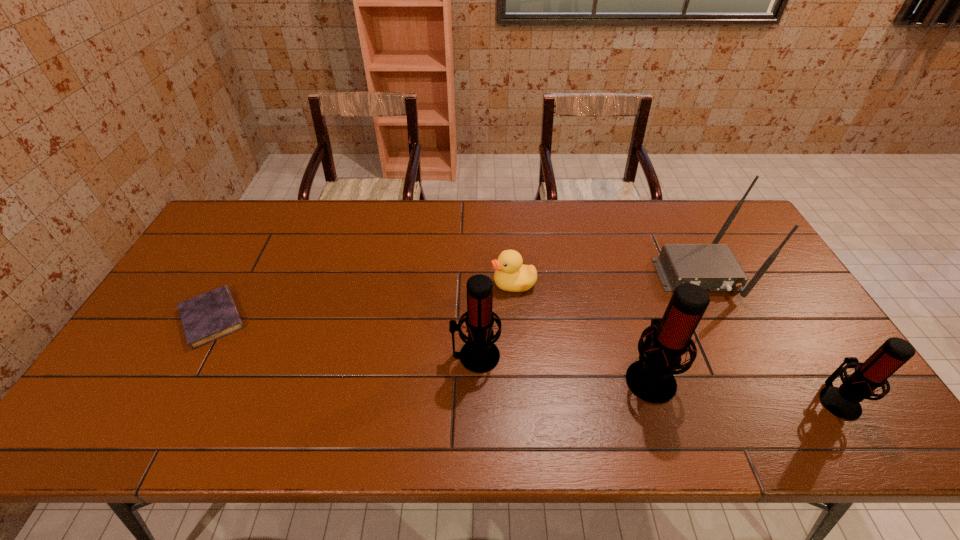
This screenshot has width=960, height=540. In order to click on vacant area between the fifth object from left to right and the shortest microphone in this screenshot , I will do `click(768, 337)`.

This screenshot has height=540, width=960. In order to click on vacant area that lies between the second microphone from right to left and the diary in this screenshot , I will do `click(431, 348)`.

You are a GUI agent. You are given a task and a screenshot of the screen. Output one action in this format:
    pyautogui.click(x=<x>, y=<y>)
    Task: Click on the unoccupied area between the router and the rightmost object
    This screenshot has width=960, height=540.
    Given the screenshot: What is the action you would take?
    pyautogui.click(x=768, y=337)

Locate an element on the screen. The image size is (960, 540). vacant point located between the fourth object from left to right and the duck is located at coordinates (582, 330).

In order to click on free space between the shortest microphone and the fourth object from left to right in this screenshot , I will do `click(744, 388)`.

Identify the location of object that is the fifth nearest to the third object from right to left. (212, 315).

Identify which object is the nearest to the second tallest microphone. Please provide its 2D coordinates. Your answer should be formatted as a tuple, i.e. [(x, y)], where the tuple contains the x and y coordinates of a point satisfying the conditions above.

[(511, 275)]

At what (x,y) coordinates should I click in order to perform the action: click on the second closest microphone to the rightmost object. Please return your answer as a coordinate pair (x, y). Looking at the image, I should click on (479, 355).

The width and height of the screenshot is (960, 540). I want to click on microphone that can be found as the third closest to the router, so click(479, 355).

Identify the location of vacant space that satisfies the following two spatial constraints: 1. on the back side of the third object from right to left; 2. at the beak of the second shortest object. (620, 284).